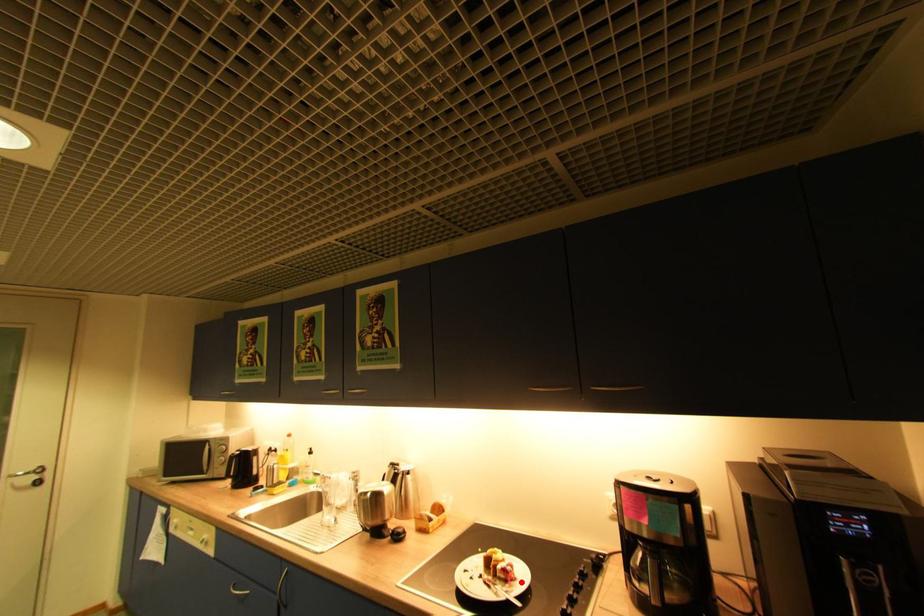
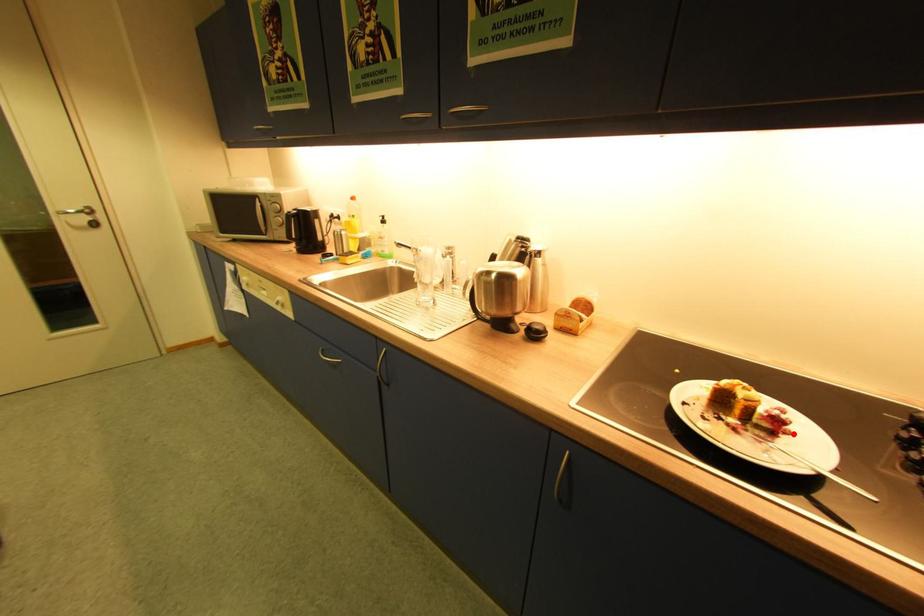
I am providing you with two images of the same scene from different viewpoints. A red point is marked on the first image and another point is marked on the second image. Does the point marked in image1 correspond to the same location as the one in image2?

Yes